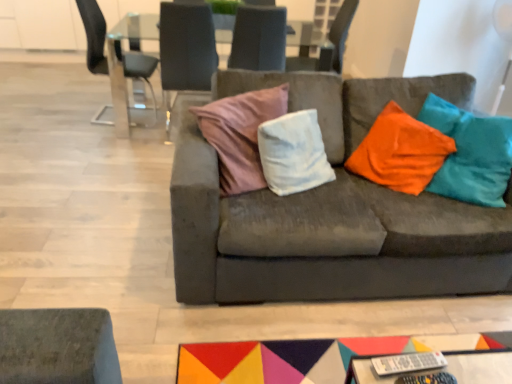
The image size is (512, 384). What do you see at coordinates (327, 44) in the screenshot?
I see `suede-like gray chair at upper center, which is the 1th chair from right to left` at bounding box center [327, 44].

What is the approximate width of metallic glass chair at upper left, which is the 4th chair in right-to-left order?

It is 22.44 inches.

Where is `transparent glass table at upper center`? transparent glass table at upper center is located at coordinates (121, 62).

From the image's perspective, does velvet cushion at center, the second chair from the left, appear higher than suede-like gray chair at upper center, the 2th chair viewed from the right?

No.

Could you measure the distance between velvet cushion at center, the second chair from the left, and suede-like gray chair at upper center, the 2th chair viewed from the right?

velvet cushion at center, the second chair from the left, and suede-like gray chair at upper center, the 2th chair viewed from the right, are 12.82 inches apart.

Which is closer to the camera, (206, 22) or (234, 22)?

Point (206, 22) is positioned closer to the camera compared to point (234, 22).

Considering the positions of point (90, 14) and point (246, 67), is point (90, 14) closer or farther from the camera than point (246, 67)?

Clearly, point (90, 14) is more distant from the camera than point (246, 67).

Does metallic glass chair at upper left, the first chair from the left, turn towards suede-like gray chair at upper center, the 2th chair viewed from the right?

Yes, metallic glass chair at upper left, the first chair from the left, is aimed at suede-like gray chair at upper center, the 2th chair viewed from the right.

From the image's perspective, is metallic glass chair at upper left, the first chair from the left, on suede-like gray chair at upper center, placed as the third chair when sorted from left to right?

No, from the image's perspective, metallic glass chair at upper left, the first chair from the left, is not on top of suede-like gray chair at upper center, placed as the third chair when sorted from left to right.

Which object is positioned more to the left, metallic glass chair at upper left, which is the 4th chair in right-to-left order, or suede-like gray chair at upper center, placed as the third chair when sorted from left to right?

Positioned to the left is metallic glass chair at upper left, which is the 4th chair in right-to-left order.

From the image's perspective, between suede couch at center and transparent glass table at upper center, which one is located above?

transparent glass table at upper center.

Locate an element on the screen. The image size is (512, 384). studio couch below the transparent glass table at upper center (from the image's perspective) is located at coordinates (331, 211).

From the picture: Are suede couch at center and transparent glass table at upper center located far from each other?

Yes, suede couch at center and transparent glass table at upper center are located far from each other.

Does suede couch at center appear on the left side of transparent glass table at upper center?

Incorrect, suede couch at center is not on the left side of transparent glass table at upper center.

Would you say suede-like gray chair at upper center, which is the 1th chair from right to left, is outside suede couch at center?

suede-like gray chair at upper center, which is the 1th chair from right to left, is positioned outside suede couch at center.

Is suede-like gray chair at upper center, placed as the 4th chair when sorted from left to right, thinner than suede couch at center?

Indeed, suede-like gray chair at upper center, placed as the 4th chair when sorted from left to right, has a lesser width compared to suede couch at center.

From the image's perspective, is suede-like gray chair at upper center, which is the 1th chair from right to left, positioned above or below suede couch at center?

suede-like gray chair at upper center, which is the 1th chair from right to left, is situated higher than suede couch at center in the image.

Relative to velvet cushion at center, the third chair when ordered from right to left, is transparent glass table at upper center in front or behind?

Visually, transparent glass table at upper center is located behind velvet cushion at center, the third chair when ordered from right to left.

In the scene shown: Is velvet cushion at center, the third chair when ordered from right to left, a part of transparent glass table at upper center?

Yes, velvet cushion at center, the third chair when ordered from right to left, is a part of transparent glass table at upper center.

Which object is positioned more to the right, transparent glass table at upper center or velvet cushion at center, the third chair when ordered from right to left?

transparent glass table at upper center.

Is there a large distance between transparent glass table at upper center and velvet cushion at center, the second chair from the left?

Actually, transparent glass table at upper center and velvet cushion at center, the second chair from the left, are a little close together.

Is point (90, 30) more distant than point (196, 29)?

Yes, point (90, 30) is farther from viewer.

Which is more to the left, metallic glass chair at upper left, which is the 4th chair in right-to-left order, or velvet cushion at center, the second chair from the left?

Positioned to the left is metallic glass chair at upper left, which is the 4th chair in right-to-left order.

Can velvet cushion at center, the second chair from the left, be found inside metallic glass chair at upper left, the first chair from the left?

No.

Relative to velvet cushion at center, the third chair when ordered from right to left, is metallic glass chair at upper left, which is the 4th chair in right-to-left order, in front or behind?

metallic glass chair at upper left, which is the 4th chair in right-to-left order, is positioned farther from the viewer than velvet cushion at center, the third chair when ordered from right to left.

Which point is more forward, (232,67) or (212,42)?

The point (212,42) is more forward.

From a real-world perspective, which chair is the 2nd one above the velvet cushion at center, the second chair from the left? Please provide its 2D coordinates.

[(259, 38)]

Considering the positions of objects suede-like gray chair at upper center, placed as the third chair when sorted from left to right, and velvet cushion at center, the second chair from the left, in the image provided, who is behind, suede-like gray chair at upper center, placed as the third chair when sorted from left to right, or velvet cushion at center, the second chair from the left,?

suede-like gray chair at upper center, placed as the third chair when sorted from left to right, is further away from the camera.

At what (x,y) coordinates should I click in order to perform the action: click on the 2nd chair below the suede-like gray chair at upper center, the 2th chair viewed from the right (from a real-world perspective). Please return your answer as a coordinate pair (x, y). Image resolution: width=512 pixels, height=384 pixels. Looking at the image, I should click on (186, 48).

Which chair is the 2nd one when counting from the right side of the metallic glass chair at upper left, which is the 4th chair in right-to-left order? Please provide its 2D coordinates.

[(259, 38)]

Considering their positions, is suede couch at center positioned further to transparent glass table at upper center than velvet cushion at center, the second chair from the left?

suede couch at center is positioned further to the anchor transparent glass table at upper center.

Looking at the image, which one is located closer to transparent glass table at upper center, velvet cushion at center, the third chair when ordered from right to left, or suede couch at center?

Based on the image, velvet cushion at center, the third chair when ordered from right to left, appears to be nearer to transparent glass table at upper center.

Looking at the image, which one is located closer to suede-like gray chair at upper center, the 2th chair viewed from the right, suede-like gray chair at upper center, which is the 1th chair from right to left, or metallic glass chair at upper left, which is the 4th chair in right-to-left order?

The object closer to suede-like gray chair at upper center, the 2th chair viewed from the right, is suede-like gray chair at upper center, which is the 1th chair from right to left.

Estimate the real-world distances between objects in this image. Which object is further from suede-like gray chair at upper center, placed as the 4th chair when sorted from left to right, metallic glass chair at upper left, which is the 4th chair in right-to-left order, or suede-like gray chair at upper center, the 2th chair viewed from the right?

metallic glass chair at upper left, which is the 4th chair in right-to-left order, is further to suede-like gray chair at upper center, placed as the 4th chair when sorted from left to right.

When comparing their distances from velvet cushion at center, the second chair from the left, does suede-like gray chair at upper center, placed as the 4th chair when sorted from left to right, or transparent glass table at upper center seem further?

Among the two, suede-like gray chair at upper center, placed as the 4th chair when sorted from left to right, is located further to velvet cushion at center, the second chair from the left.

Which object lies further to the anchor point velvet cushion at center, the second chair from the left, suede-like gray chair at upper center, placed as the third chair when sorted from left to right, or metallic glass chair at upper left, the first chair from the left?

metallic glass chair at upper left, the first chair from the left.

Estimate the real-world distances between objects in this image. Which object is further from suede couch at center, metallic glass chair at upper left, which is the 4th chair in right-to-left order, or velvet cushion at center, the second chair from the left?

The object further to suede couch at center is metallic glass chair at upper left, which is the 4th chair in right-to-left order.

Estimate the real-world distances between objects in this image. Which object is further from suede-like gray chair at upper center, placed as the 4th chair when sorted from left to right, metallic glass chair at upper left, the first chair from the left, or transparent glass table at upper center?

Based on the image, metallic glass chair at upper left, the first chair from the left, appears to be further to suede-like gray chair at upper center, placed as the 4th chair when sorted from left to right.

Find the location of a particular element. This screenshot has height=384, width=512. chair situated between metallic glass chair at upper left, the first chair from the left, and transparent glass table at upper center from left to right is located at coordinates (186, 48).

I want to click on table between velvet cushion at center, the third chair when ordered from right to left, and suede-like gray chair at upper center, placed as the 4th chair when sorted from left to right, so click(121, 62).

Where is `table between suede couch at center and metallic glass chair at upper left, the first chair from the left, along the z-axis`? table between suede couch at center and metallic glass chair at upper left, the first chair from the left, along the z-axis is located at coordinates (121, 62).

The width and height of the screenshot is (512, 384). I want to click on table located between suede couch at center and suede-like gray chair at upper center, which is the 1th chair from right to left, in the depth direction, so [x=121, y=62].